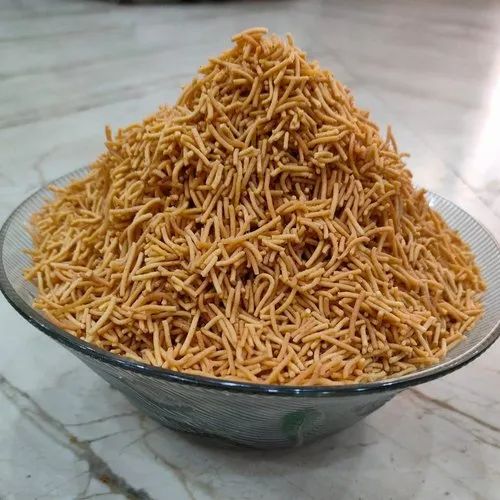
This screenshot has height=500, width=500. Find the location of `glass bowl`. glass bowl is located at coordinates (280, 414).